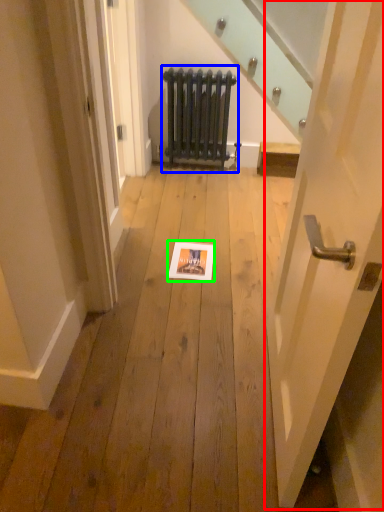
Question: Which object is positioned farthest from door (highlighted by a red box)? Select from radiator (highlighted by a blue box) and picture frame (highlighted by a green box).

Choices:
 (A) radiator
 (B) picture frame

Answer: (A)